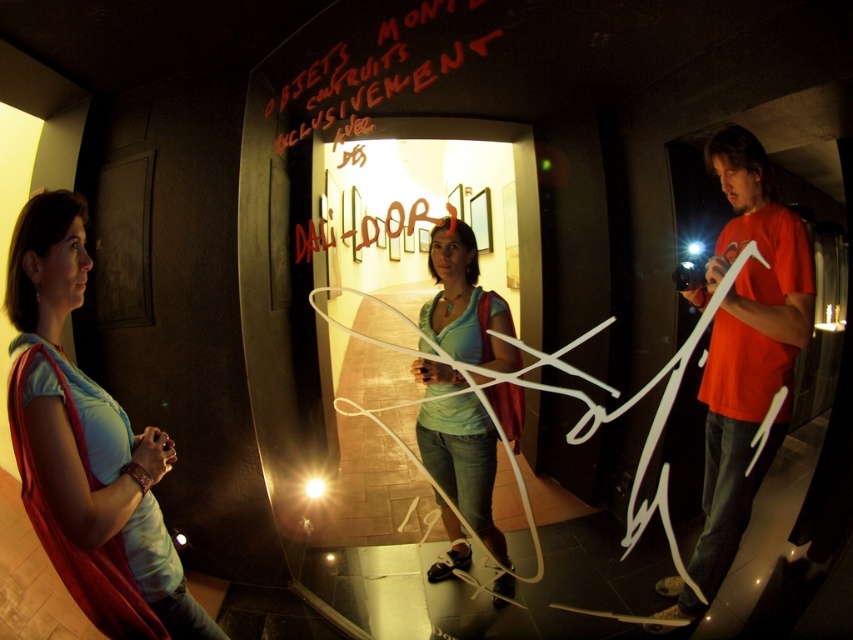
Between point (115, 588) and point (735, 192), which one is positioned in front?

Point (735, 192) is more forward.

Can you confirm if blue fabric scarf at left is bigger than matte red t-shirt at right?

Indeed, blue fabric scarf at left has a larger size compared to matte red t-shirt at right.

Is point (115, 408) farther from viewer compared to point (741, 458)?

Yes, it is.

In order to click on blue fabric scarf at left in this screenshot , I will do `click(86, 448)`.

Which is below, matte red t-shirt at right or matte teal shirt at center?

matte teal shirt at center is below.

Which is above, matte red t-shirt at right or matte teal shirt at center?

matte red t-shirt at right is higher up.

Find the location of a particular element. This screenshot has width=853, height=640. matte red t-shirt at right is located at coordinates (746, 342).

The width and height of the screenshot is (853, 640). Describe the element at coordinates (86, 448) in the screenshot. I see `blue fabric scarf at left` at that location.

Is blue fabric scarf at left to the right of matte teal shirt at center from the viewer's perspective?

No, blue fabric scarf at left is not to the right of matte teal shirt at center.

Which is behind, point (157, 449) or point (503, 545)?

The point (503, 545) is behind.

Locate an element on the screen. The width and height of the screenshot is (853, 640). blue fabric scarf at left is located at coordinates (86, 448).